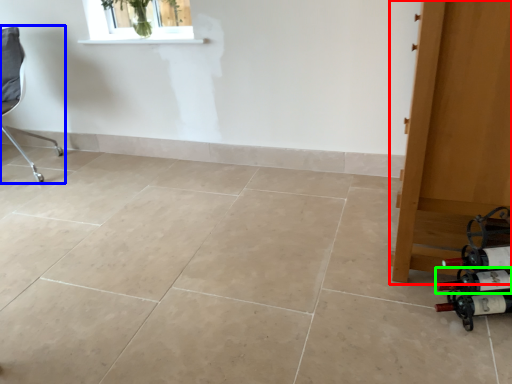
Question: Which object is positioned farthest from door (highlighted by a red box)? Select from chair (highlighted by a blue box) and wine bottle (highlighted by a green box).

Choices:
 (A) chair
 (B) wine bottle

Answer: (A)